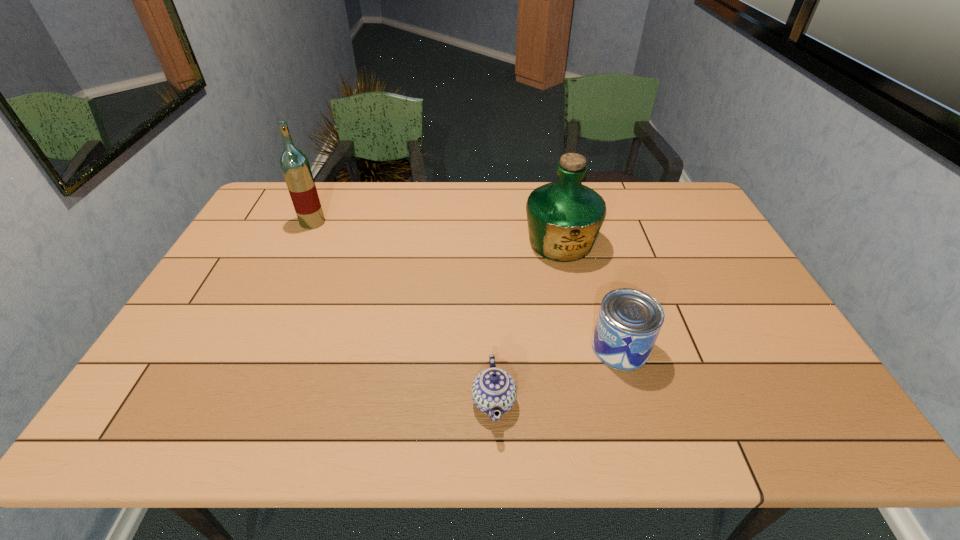
At what (x,y) coordinates should I click in order to perform the action: click on free space located 0.260m on the front label of the can. Please return your answer as a coordinate pair (x, y). Image resolution: width=960 pixels, height=540 pixels. Looking at the image, I should click on (488, 347).

At what (x,y) coordinates should I click in order to perform the action: click on vacant region located 0.140m on the front label of the can. Please return your answer as a coordinate pair (x, y). Image resolution: width=960 pixels, height=540 pixels. Looking at the image, I should click on (536, 347).

In order to click on vacant area located 0.370m at the spout of the chinaware in this screenshot , I will do `click(307, 401)`.

Identify the location of vacant space located 0.310m at the spout of the chinaware. The width and height of the screenshot is (960, 540). (334, 401).

Identify the location of free space located at the spout of the chinaware. (373, 401).

At what (x,y) coordinates should I click in order to perform the action: click on object that is positioned at the far edge. Please return your answer as a coordinate pair (x, y). Looking at the image, I should click on (295, 166).

Identify the location of object that is at the near edge. Image resolution: width=960 pixels, height=540 pixels. (493, 389).

The image size is (960, 540). Identify the location of vacant region at the far edge. (405, 217).

In the image, there is a desktop. In order to click on vacant space at the near edge in this screenshot , I will do `click(227, 420)`.

In the image, there is a desktop. Identify the location of vacant area at the left edge. (214, 363).